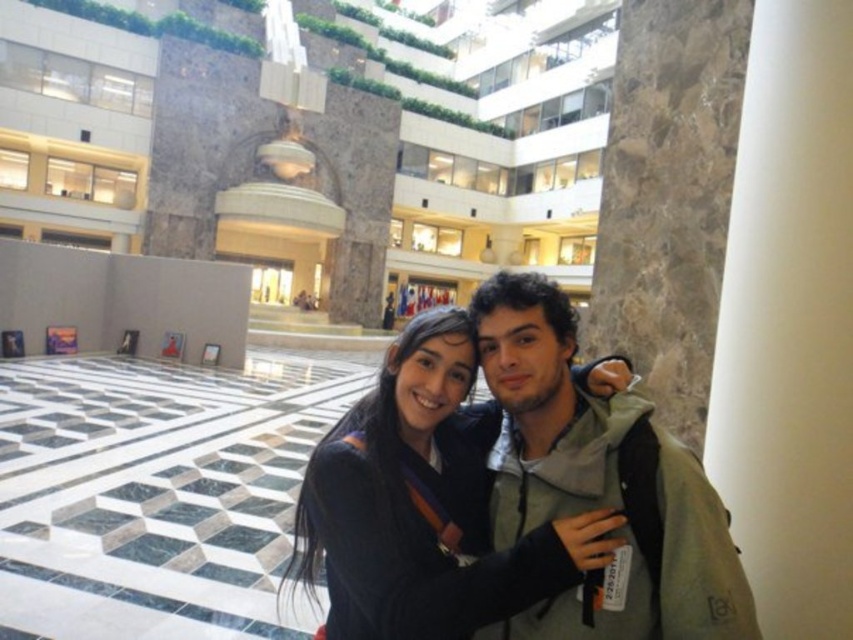
Question: Among these objects, which one is farthest from the camera?

Choices:
 (A) dark gray sweater at center
 (B) gray fabric jacket at center

Answer: (A)

Question: Can you confirm if gray fabric jacket at center is positioned below dark gray sweater at center?

Choices:
 (A) no
 (B) yes

Answer: (B)

Question: Does gray fabric jacket at center lie in front of dark gray sweater at center?

Choices:
 (A) no
 (B) yes

Answer: (B)

Question: Does gray fabric jacket at center lie behind dark gray sweater at center?

Choices:
 (A) no
 (B) yes

Answer: (A)

Question: Which point is farther to the camera?

Choices:
 (A) dark gray sweater at center
 (B) gray fabric jacket at center

Answer: (A)